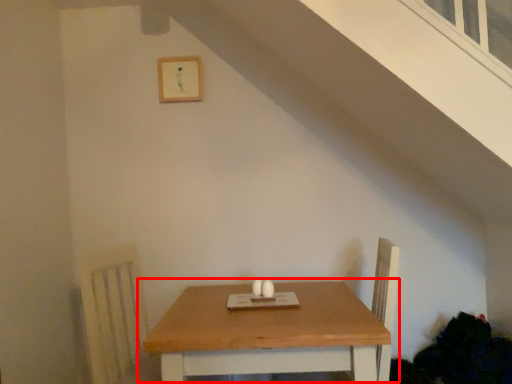
Question: Where is table (annotated by the red box) located in relation to picture frame in the image?

Choices:
 (A) left
 (B) right

Answer: (B)